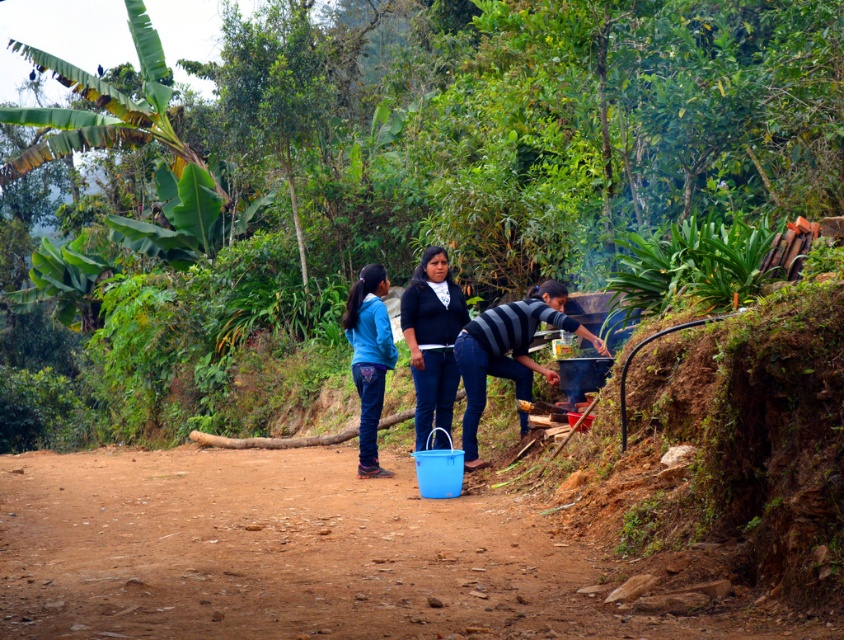
You are designing a new clothing line and want to create a matching set using the matte black sweater at center and the blue fabric pants at center. Based on their widths, which piece should you adjust to ensure they align properly?

The matte black sweater at center might be wider than blue fabric pants at center, so you should adjust the blue fabric pants at center to match the width of the matte black sweater at center.